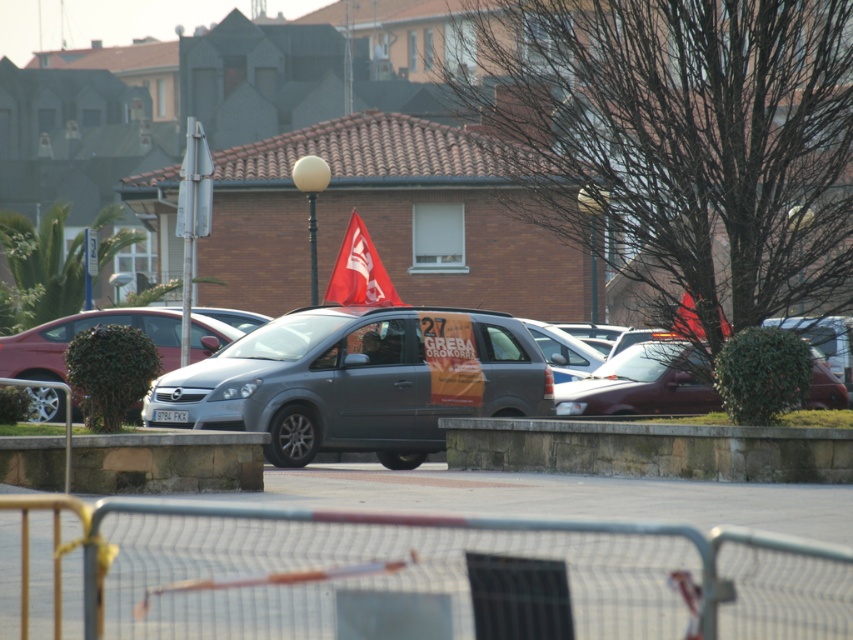
Who is positioned more to the right, silver metallic van at center or metallic gray van at center?

From the viewer's perspective, silver metallic van at center appears more on the right side.

Does point (444, 317) lie behind point (280, 392)?

Yes, it is.

At what (x,y) coordinates should I click in order to perform the action: click on silver metallic van at center. Please return your answer as a coordinate pair (x, y). Looking at the image, I should click on (387, 381).

In the scene shown: Is matte gray van at center behind satin silver sedan at center?

No, matte gray van at center is in front of satin silver sedan at center.

Is matte gray van at center taller than satin silver sedan at center?

Yes.

Does point (625, 381) come farther from viewer compared to point (86, 312)?

That is False.

Identify the location of matte gray van at center. (643, 384).

Between matte gray van at center and matte red flag at center, which one has more height?

With more height is matte red flag at center.

Can you confirm if matte gray van at center is wider than matte red flag at center?

Yes, matte gray van at center is wider than matte red flag at center.

Is point (643, 408) farther from viewer compared to point (363, 237)?

That is False.

You are a GUI agent. You are given a task and a screenshot of the screen. Output one action in this format:
    pyautogui.click(x=<x>, y=<y>)
    Task: Click on the matte gray van at center
    Image resolution: width=853 pixels, height=640 pixels.
    Given the screenshot: What is the action you would take?
    pyautogui.click(x=643, y=384)